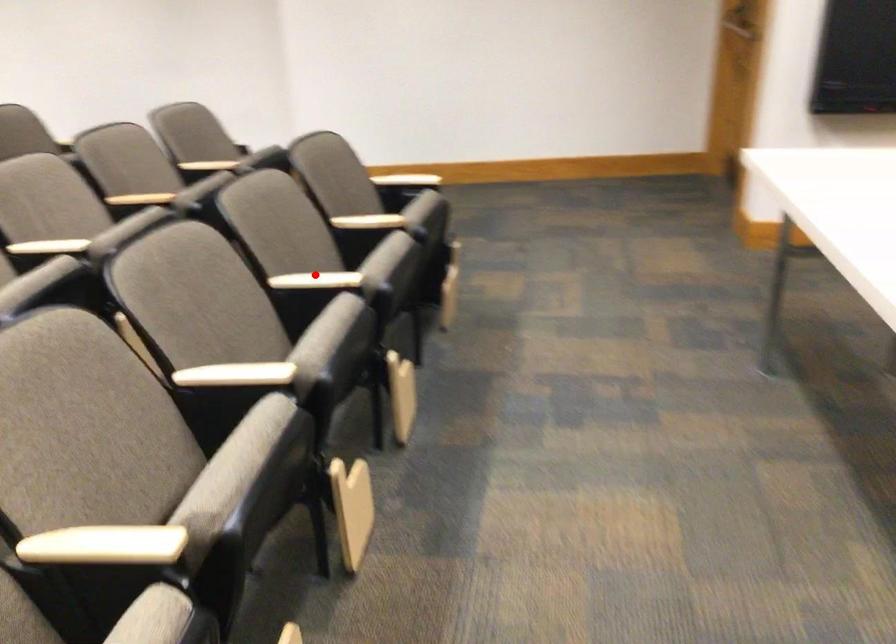
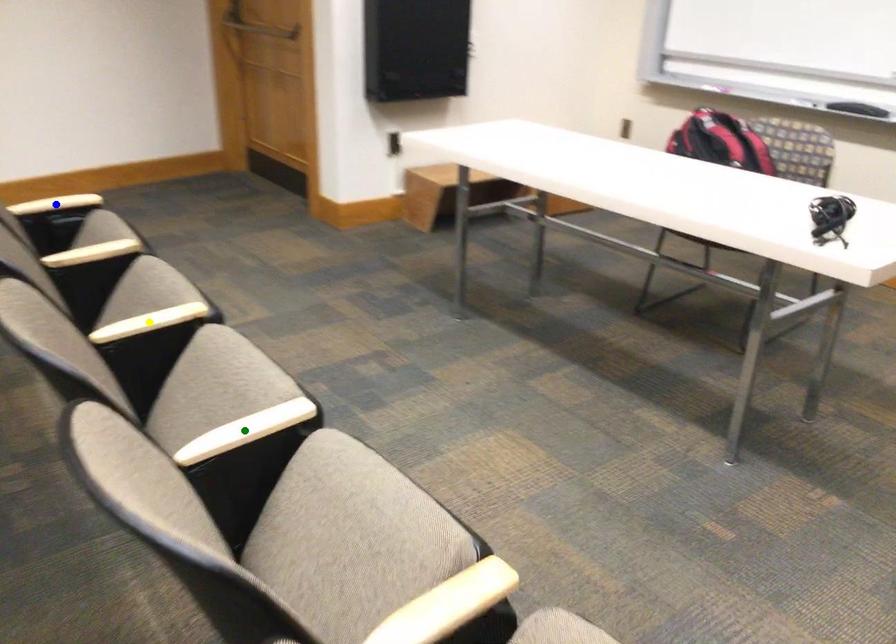
Question: I am providing you with two images of the same scene from different viewpoints. A red point is marked on the first image. You are given multiple points on the second image. Which point in image 2 represents the same 3d spot as the red point in image 1?

Choices:
 (A) blue point
 (B) green point
 (C) yellow point

Answer: (C)